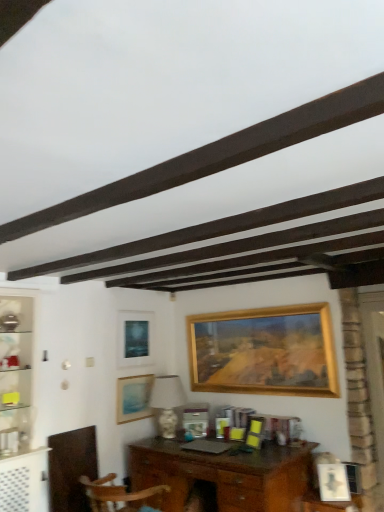
Describe the element at coordinates (225, 475) in the screenshot. This screenshot has height=512, width=384. I see `wooden desk at center` at that location.

What do you see at coordinates (196, 426) in the screenshot? Image resolution: width=384 pixels, height=512 pixels. I see `wooden picture frame at center, placed as the 3th picture frame when sorted from right to left` at bounding box center [196, 426].

Describe the element at coordinates (135, 338) in the screenshot. I see `matte black picture frame at center, the fifth picture frame from the right` at that location.

Locate an element on the screen. Image resolution: width=384 pixels, height=512 pixels. matte blue picture frame at lower left, placed as the 4th picture frame when sorted from right to left is located at coordinates (133, 398).

What is the approximate width of matte blue picture frame at lower left, placed as the 4th picture frame when sorted from right to left?

matte blue picture frame at lower left, placed as the 4th picture frame when sorted from right to left, is 1.31 inches in width.

You are a GUI agent. You are given a task and a screenshot of the screen. Output one action in this format:
    pyautogui.click(x=<x>, y=<y>)
    Task: Click on the gold wooden picture frame at center, the 2th picture frame in the right-to-left sequence
    This screenshot has width=384, height=512.
    Given the screenshot: What is the action you would take?
    pyautogui.click(x=264, y=351)

Can you tell me how much white glossy lamp at center and matte blue picture frame at lower left, placed as the 4th picture frame when sorted from right to left, differ in facing direction?

They differ by 89.3 degrees in their facing directions.

From a real-world perspective, who is located higher, white glossy lamp at center or matte blue picture frame at lower left, placed as the 4th picture frame when sorted from right to left?

matte blue picture frame at lower left, placed as the 4th picture frame when sorted from right to left.

Considering the sizes of objects white glossy lamp at center and matte blue picture frame at lower left, which is counted as the 2th picture frame, starting from the left, in the image provided, who is wider, white glossy lamp at center or matte blue picture frame at lower left, which is counted as the 2th picture frame, starting from the left,?

white glossy lamp at center.

Is white glossy lamp at center closer to the viewer compared to matte blue picture frame at lower left, which is counted as the 2th picture frame, starting from the left?

Yes.

Which of these two, matte white picture frame at lower right, the first picture frame in the right-to-left sequence, or matte blue picture frame at lower left, placed as the 4th picture frame when sorted from right to left, is wider?

Wider between the two is matte white picture frame at lower right, the first picture frame in the right-to-left sequence.

Does matte white picture frame at lower right, the 5th picture frame in the left-to-right sequence, lie behind matte blue picture frame at lower left, which is counted as the 2th picture frame, starting from the left?

That is False.

Is matte white picture frame at lower right, the first picture frame in the right-to-left sequence, placed right next to matte blue picture frame at lower left, which is counted as the 2th picture frame, starting from the left?

matte white picture frame at lower right, the first picture frame in the right-to-left sequence, is not next to matte blue picture frame at lower left, which is counted as the 2th picture frame, starting from the left, and they're not touching.

Which point is more forward, (318, 475) or (133, 413)?

Positioned in front is point (318, 475).

Looking at this image, from the image's perspective, is wooden picture frame at center, placed as the 3th picture frame when sorted from right to left, beneath matte white picture frame at lower right, the 5th picture frame in the left-to-right sequence?

No, from the image's perspective, wooden picture frame at center, placed as the 3th picture frame when sorted from right to left, is not beneath matte white picture frame at lower right, the 5th picture frame in the left-to-right sequence.

In terms of size, does wooden picture frame at center, placed as the 3th picture frame when sorted from right to left, appear bigger or smaller than matte white picture frame at lower right, the 5th picture frame in the left-to-right sequence?

wooden picture frame at center, placed as the 3th picture frame when sorted from right to left, is smaller than matte white picture frame at lower right, the 5th picture frame in the left-to-right sequence.

Locate an element on the screen. The width and height of the screenshot is (384, 512). picture frame below the wooden picture frame at center, placed as the 3th picture frame when sorted from right to left (from the image's perspective) is located at coordinates (333, 482).

Is wooden picture frame at center, which is the third picture frame in left-to-right order, to the left of matte white picture frame at lower right, the 5th picture frame in the left-to-right sequence, from the viewer's perspective?

Yes.

From a real-world perspective, starting from the matte black picture frame at center, marked as the 1th picture frame in a left-to-right arrangement, which picture frame is the 2nd one below it? Please provide its 2D coordinates.

[(133, 398)]

Can you tell me how much matte blue picture frame at lower left, placed as the 4th picture frame when sorted from right to left, and matte black picture frame at center, the fifth picture frame from the right, differ in facing direction?

The angular difference between matte blue picture frame at lower left, placed as the 4th picture frame when sorted from right to left, and matte black picture frame at center, the fifth picture frame from the right, is 0.674 degrees.

From the picture: Who is smaller, matte blue picture frame at lower left, which is counted as the 2th picture frame, starting from the left, or matte black picture frame at center, the fifth picture frame from the right?

matte blue picture frame at lower left, which is counted as the 2th picture frame, starting from the left.

From a real-world perspective, does matte blue picture frame at lower left, placed as the 4th picture frame when sorted from right to left, stand above matte black picture frame at center, the fifth picture frame from the right?

No, from a real-world perspective, matte blue picture frame at lower left, placed as the 4th picture frame when sorted from right to left, is not over matte black picture frame at center, the fifth picture frame from the right

Based on the photo, which is more to the left, matte white picture frame at lower right, the 5th picture frame in the left-to-right sequence, or gold wooden picture frame at center, the 2th picture frame in the right-to-left sequence?

gold wooden picture frame at center, the 2th picture frame in the right-to-left sequence.

Who is shorter, matte white picture frame at lower right, the first picture frame in the right-to-left sequence, or gold wooden picture frame at center, the 2th picture frame in the right-to-left sequence?

matte white picture frame at lower right, the first picture frame in the right-to-left sequence, is shorter.

Would you say matte white picture frame at lower right, the 5th picture frame in the left-to-right sequence, is a long distance from gold wooden picture frame at center, the 2th picture frame in the right-to-left sequence?

matte white picture frame at lower right, the 5th picture frame in the left-to-right sequence, is far away from gold wooden picture frame at center, the 2th picture frame in the right-to-left sequence.

Between gold wooden picture frame at center, the 2th picture frame in the right-to-left sequence, and matte white picture frame at lower right, the 5th picture frame in the left-to-right sequence, which one is positioned in front?

Positioned in front is matte white picture frame at lower right, the 5th picture frame in the left-to-right sequence.

Can we say gold wooden picture frame at center, arranged as the 4th picture frame when viewed from the left, lies outside matte white picture frame at lower right, the first picture frame in the right-to-left sequence?

That's correct, gold wooden picture frame at center, arranged as the 4th picture frame when viewed from the left, is outside of matte white picture frame at lower right, the first picture frame in the right-to-left sequence.

Is gold wooden picture frame at center, the 2th picture frame in the right-to-left sequence, facing away from matte white picture frame at lower right, the 5th picture frame in the left-to-right sequence?

No, gold wooden picture frame at center, the 2th picture frame in the right-to-left sequence,'s orientation is not away from matte white picture frame at lower right, the 5th picture frame in the left-to-right sequence.

From a real-world perspective, which is physically below, gold wooden picture frame at center, the 2th picture frame in the right-to-left sequence, or matte white picture frame at lower right, the first picture frame in the right-to-left sequence?

From a 3D spatial view, matte white picture frame at lower right, the first picture frame in the right-to-left sequence, is below.

Is point (145, 411) closer to camera compared to point (268, 502)?

No, it is not.

From the image's perspective, which one is positioned higher, matte blue picture frame at lower left, placed as the 4th picture frame when sorted from right to left, or wooden desk at center?

matte blue picture frame at lower left, placed as the 4th picture frame when sorted from right to left, appears higher in the image.

Does matte blue picture frame at lower left, placed as the 4th picture frame when sorted from right to left, have a lesser width compared to wooden desk at center?

Yes, matte blue picture frame at lower left, placed as the 4th picture frame when sorted from right to left, is thinner than wooden desk at center.

Between matte blue picture frame at lower left, placed as the 4th picture frame when sorted from right to left, and wooden desk at center, which one appears on the right side from the viewer's perspective?

From the viewer's perspective, wooden desk at center appears more on the right side.

I want to click on lamp that appears below the matte blue picture frame at lower left, placed as the 4th picture frame when sorted from right to left (from a real-world perspective), so click(167, 403).

Which picture frame is the 3rd one when counting from the left side of the matte white picture frame at lower right, the 5th picture frame in the left-to-right sequence? Please provide its 2D coordinates.

[(133, 398)]

From the picture: When comparing their distances from matte black picture frame at center, the fifth picture frame from the right, does wooden desk at center or white glossy lamp at center seem further?

wooden desk at center is further to matte black picture frame at center, the fifth picture frame from the right.

From the image, which object appears to be nearer to matte white picture frame at lower right, the first picture frame in the right-to-left sequence, white glossy lamp at center or wooden desk at center?

Among the two, wooden desk at center is located nearer to matte white picture frame at lower right, the first picture frame in the right-to-left sequence.

When comparing their distances from matte white picture frame at lower right, the first picture frame in the right-to-left sequence, does matte black picture frame at center, the fifth picture frame from the right, or matte blue picture frame at lower left, placed as the 4th picture frame when sorted from right to left, seem further?

matte black picture frame at center, the fifth picture frame from the right, is positioned further to the anchor matte white picture frame at lower right, the first picture frame in the right-to-left sequence.

Estimate the real-world distances between objects in this image. Which object is further from wooden picture frame at center, which is the third picture frame in left-to-right order, gold wooden picture frame at center, arranged as the 4th picture frame when viewed from the left, or matte black picture frame at center, the fifth picture frame from the right?

Based on the image, matte black picture frame at center, the fifth picture frame from the right, appears to be further to wooden picture frame at center, which is the third picture frame in left-to-right order.

From the image, which object appears to be nearer to matte white picture frame at lower right, the 5th picture frame in the left-to-right sequence, matte black picture frame at center, the fifth picture frame from the right, or wooden desk at center?

wooden desk at center is closer to matte white picture frame at lower right, the 5th picture frame in the left-to-right sequence.

Estimate the real-world distances between objects in this image. Which object is closer to gold wooden picture frame at center, arranged as the 4th picture frame when viewed from the left, matte white picture frame at lower right, the 5th picture frame in the left-to-right sequence, or matte blue picture frame at lower left, which is counted as the 2th picture frame, starting from the left?

matte blue picture frame at lower left, which is counted as the 2th picture frame, starting from the left, is positioned closer to the anchor gold wooden picture frame at center, arranged as the 4th picture frame when viewed from the left.

Based on their spatial positions, is matte blue picture frame at lower left, placed as the 4th picture frame when sorted from right to left, or matte black picture frame at center, marked as the 1th picture frame in a left-to-right arrangement, closer to matte white picture frame at lower right, the first picture frame in the right-to-left sequence?

matte blue picture frame at lower left, placed as the 4th picture frame when sorted from right to left, is positioned closer to the anchor matte white picture frame at lower right, the first picture frame in the right-to-left sequence.

Which object lies nearer to the anchor point white glossy lamp at center, wooden picture frame at center, which is the third picture frame in left-to-right order, or wooden desk at center?

wooden picture frame at center, which is the third picture frame in left-to-right order, is closer to white glossy lamp at center.

You are a GUI agent. You are given a task and a screenshot of the screen. Output one action in this format:
    pyautogui.click(x=<x>, y=<y>)
    Task: Click on the desk located between matte blue picture frame at lower left, placed as the 4th picture frame when sorted from right to left, and matte white picture frame at lower right, the first picture frame in the right-to-left sequence, in the left-right direction
    
    Given the screenshot: What is the action you would take?
    pyautogui.click(x=225, y=475)

Locate an element on the screen. lamp between gold wooden picture frame at center, arranged as the 4th picture frame when viewed from the left, and wooden desk at center, in the vertical direction is located at coordinates (167, 403).

Where is `lamp between matte black picture frame at center, the fifth picture frame from the right, and gold wooden picture frame at center, arranged as the 4th picture frame when viewed from the left, from left to right`? lamp between matte black picture frame at center, the fifth picture frame from the right, and gold wooden picture frame at center, arranged as the 4th picture frame when viewed from the left, from left to right is located at coordinates (167, 403).

Find the location of `lamp between matte blue picture frame at lower left, which is counted as the 2th picture frame, starting from the left, and wooden picture frame at center, which is the third picture frame in left-to-right order, in the horizontal direction`. lamp between matte blue picture frame at lower left, which is counted as the 2th picture frame, starting from the left, and wooden picture frame at center, which is the third picture frame in left-to-right order, in the horizontal direction is located at coordinates (167, 403).